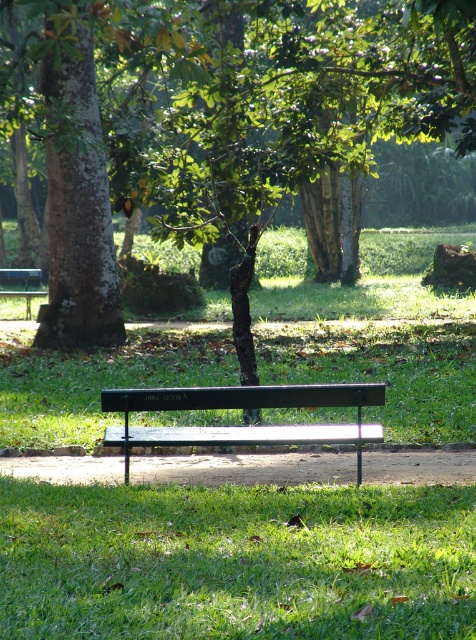
Looking at this image, you are standing at the entrance of the park and want to find the green metallic bench at center. According to the coordinates provided, where should you look to locate it?

The green metallic bench at center is located at point (235, 563), so you should look towards the upper right area of the image to find it.

You are standing at the point with coordinates point (327, 384) and want to walk towards the point (75, 72). Will you be moving towards the bench or away from it?

Answer: Since point (75, 72) is behind point (327, 384), moving towards point (75, 72) would mean moving away from the bench.